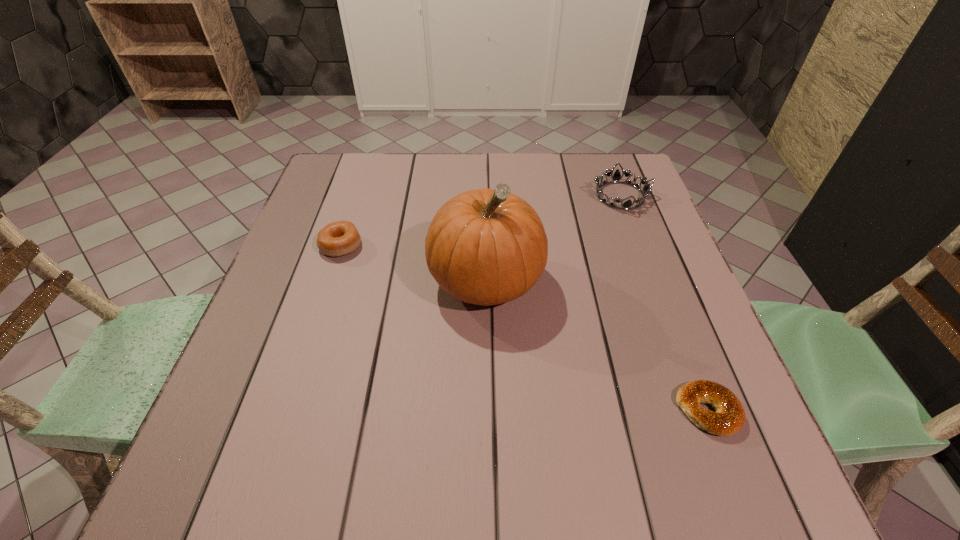
The width and height of the screenshot is (960, 540). In order to click on free location that satisfies the following two spatial constraints: 1. on the back side of the nearer bagel; 2. on the front-facing side of the tiara in this screenshot , I will do `click(625, 196)`.

Where is `vacant space that satisfies the following two spatial constraints: 1. on the stem of the pumpkin; 2. on the right side of the shorter bagel`? The image size is (960, 540). vacant space that satisfies the following two spatial constraints: 1. on the stem of the pumpkin; 2. on the right side of the shorter bagel is located at coordinates (488, 410).